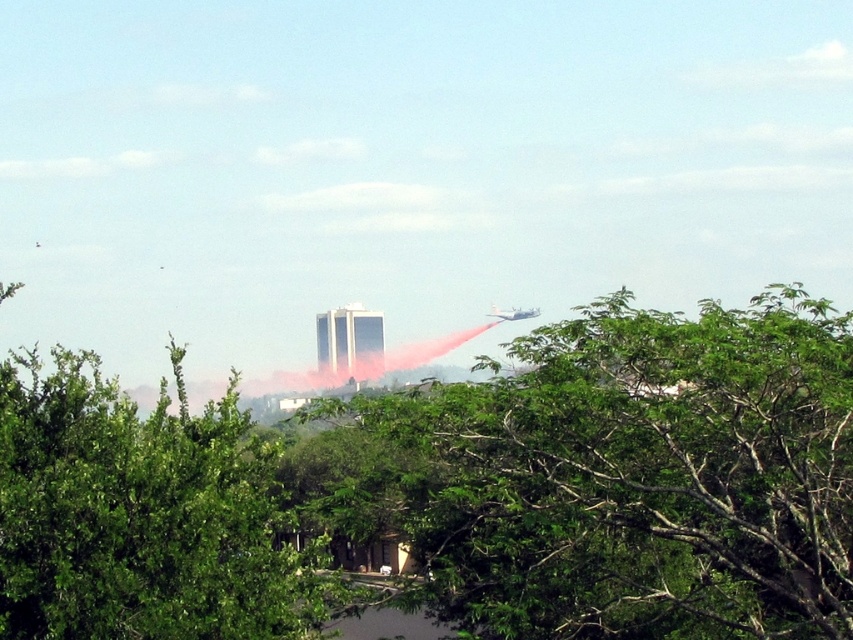
Question: Is green leafy tree at center thinner than metallic silver airplane at upper right?

Choices:
 (A) no
 (B) yes

Answer: (A)

Question: Where is green leafy tree at center located in relation to metallic silver airplane at upper right in the image?

Choices:
 (A) left
 (B) right

Answer: (A)

Question: Does green leafy tree at center appear under metallic silver airplane at upper right?

Choices:
 (A) yes
 (B) no

Answer: (A)